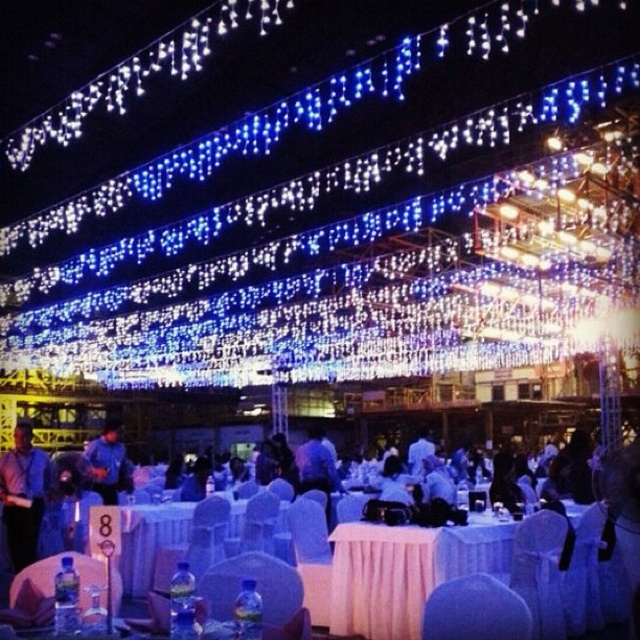
Does dark blue shirt at left appear over blue fabric shirt at center?

Yes.

Does point (24, 538) come in front of point (109, 449)?

Yes.

This screenshot has height=640, width=640. What are the coordinates of `dark blue shirt at left` in the screenshot? It's located at (22, 493).

Does blue fabric shirt at center have a greater width compared to white fabric shirt at center?

Yes, blue fabric shirt at center is wider than white fabric shirt at center.

In the scene shown: Can you confirm if blue fabric shirt at center is positioned below white fabric shirt at center?

Yes, blue fabric shirt at center is below white fabric shirt at center.

Between point (106, 480) and point (403, 493), which one is positioned in front?

Point (403, 493)

This screenshot has height=640, width=640. I want to click on blue fabric shirt at center, so click(108, 464).

Between dark blue shirt at left and white fabric shirt at center, which one appears on the left side from the viewer's perspective?

dark blue shirt at left is more to the left.

How far apart are dark blue shirt at left and white fabric shirt at center?

dark blue shirt at left and white fabric shirt at center are 35.62 feet apart.

What are the coordinates of `dark blue shirt at left` in the screenshot? It's located at (22, 493).